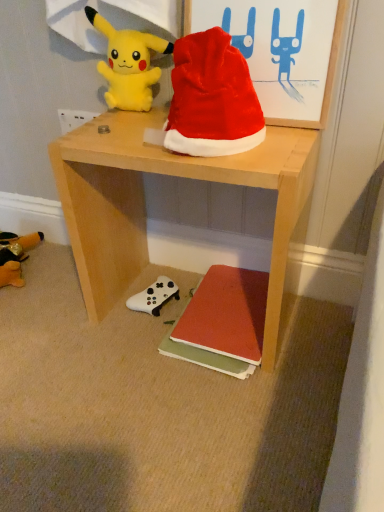
What do you see at coordinates (145, 204) in the screenshot? The image size is (384, 512). I see `light wood desk at center` at bounding box center [145, 204].

Locate an element on the screen. The image size is (384, 512). red velvet santa hat at upper center is located at coordinates (212, 98).

Describe the element at coordinates (128, 64) in the screenshot. I see `yellow plush at upper left` at that location.

Identify the location of red matte book at lower center. (222, 322).

The image size is (384, 512). In order to click on white plastic power outlet at upper left in this screenshot , I will do `click(74, 119)`.

Is red velvet santa hat at upper center closer to camera compared to yellow plush at upper left?

Yes, red velvet santa hat at upper center is in front of yellow plush at upper left.

Is red velvet santa hat at upper center placed right next to yellow plush at upper left?

No, red velvet santa hat at upper center is not touching yellow plush at upper left.

Identify the location of toy lying above the red velvet santa hat at upper center (from the image's perspective). (128, 64).

From a real-world perspective, is red velvet santa hat at upper center above or below yellow plush at upper left?

red velvet santa hat at upper center is situated lower than yellow plush at upper left in the real world.

How much distance is there between white plastic power outlet at upper left and red velvet santa hat at upper center?

white plastic power outlet at upper left and red velvet santa hat at upper center are 19.65 inches apart from each other.

Does white plastic power outlet at upper left have a greater height compared to red velvet santa hat at upper center?

No.

Consider the image. Is white plastic power outlet at upper left facing towards red velvet santa hat at upper center?

No, white plastic power outlet at upper left is not aimed at red velvet santa hat at upper center.

Which of these two, white plastic power outlet at upper left or red velvet santa hat at upper center, is bigger?

Bigger between the two is red velvet santa hat at upper center.

Who is smaller, red matte book at lower center or light wood desk at center?

red matte book at lower center is smaller.

Which is behind, red matte book at lower center or light wood desk at center?

red matte book at lower center.

From the image's perspective, is red matte book at lower center located above or below light wood desk at center?

Clearly, from the image's perspective, red matte book at lower center is below light wood desk at center.

Is red matte book at lower center directly adjacent to light wood desk at center?

No.

Which point is more distant from viewer, (x=71, y=112) or (x=239, y=287)?

The point (x=71, y=112) is behind.

Locate an element on the screen. book in front of the white plastic power outlet at upper left is located at coordinates (222, 322).

From the image's perspective, would you say white plastic power outlet at upper left is shown under red matte book at lower center?

Incorrect, from the image's perspective, white plastic power outlet at upper left is higher than red matte book at lower center.

Is white plastic power outlet at upper left situated inside red matte book at lower center or outside?

white plastic power outlet at upper left is not inside red matte book at lower center, it's outside.

Does yellow plush at upper left touch red velvet santa hat at upper center?

yellow plush at upper left and red velvet santa hat at upper center are not in contact.

Which is behind, yellow plush at upper left or red velvet santa hat at upper center?

Positioned behind is yellow plush at upper left.

Locate an element on the screen. hat in front of the yellow plush at upper left is located at coordinates (212, 98).

Does point (124, 101) lie behind point (186, 62)?

Yes, it is behind point (186, 62).

Between red matte book at lower center and white plastic power outlet at upper left, which one is positioned in front?

red matte book at lower center is closer to the camera.

Between red matte book at lower center and white plastic power outlet at upper left, which one has more height?

white plastic power outlet at upper left is taller.

Can you tell me how much red matte book at lower center and white plastic power outlet at upper left differ in facing direction?

The facing directions of red matte book at lower center and white plastic power outlet at upper left are 3.14 degrees apart.

Considering the points (211, 323) and (64, 124), which point is behind, point (211, 323) or point (64, 124)?

The point (64, 124) is more distant.

Which is less distant, (139, 110) or (224, 318)?

Point (139, 110).

How much distance is there between yellow plush at upper left and red matte book at lower center?

yellow plush at upper left and red matte book at lower center are 56.49 centimeters apart.

Which object is more forward, yellow plush at upper left or red matte book at lower center?

yellow plush at upper left is more forward.

In the scene shown: Is yellow plush at upper left facing away from red matte book at lower center?

yellow plush at upper left is not turned away from red matte book at lower center.

Identify the location of hat lying in front of the yellow plush at upper left. (212, 98).

Find the location of `power outlet above the red velvet santa hat at upper center (from the image's perspective)`. power outlet above the red velvet santa hat at upper center (from the image's perspective) is located at coordinates (74, 119).

Estimate the real-world distances between objects in this image. Which object is closer to red velvet santa hat at upper center, light wood desk at center or red matte book at lower center?

Based on the image, light wood desk at center appears to be nearer to red velvet santa hat at upper center.

From the image, which object appears to be farther from red matte book at lower center, light wood desk at center or yellow plush at upper left?

yellow plush at upper left lies further to red matte book at lower center than the other object.

When comparing their distances from red matte book at lower center, does yellow plush at upper left or white plastic power outlet at upper left seem further?

Based on the image, white plastic power outlet at upper left appears to be further to red matte book at lower center.

Based on the photo, looking at the image, which one is located closer to red matte book at lower center, white plastic power outlet at upper left or yellow plush at upper left?

yellow plush at upper left lies closer to red matte book at lower center than the other object.

Based on the photo, when comparing their distances from red matte book at lower center, does red velvet santa hat at upper center or light wood desk at center seem further?

red velvet santa hat at upper center lies further to red matte book at lower center than the other object.

Considering their positions, is white plastic power outlet at upper left positioned closer to red matte book at lower center than red velvet santa hat at upper center?

The object closer to red matte book at lower center is red velvet santa hat at upper center.

Which object lies further to the anchor point white plastic power outlet at upper left, light wood desk at center or red matte book at lower center?

red matte book at lower center is positioned further to the anchor white plastic power outlet at upper left.

When comparing their distances from red matte book at lower center, does light wood desk at center or white plastic power outlet at upper left seem further?

white plastic power outlet at upper left.

Locate an element on the screen. The image size is (384, 512). toy between red velvet santa hat at upper center and white plastic power outlet at upper left from front to back is located at coordinates (128, 64).

The width and height of the screenshot is (384, 512). I want to click on desk between red velvet santa hat at upper center and red matte book at lower center in the up-down direction, so click(x=145, y=204).

At what (x,y) coordinates should I click in order to perform the action: click on hat between yellow plush at upper left and light wood desk at center in the vertical direction. Please return your answer as a coordinate pair (x, y). This screenshot has height=512, width=384. Looking at the image, I should click on (212, 98).

What are the coordinates of `toy between light wood desk at center and white plastic power outlet at upper left from front to back` in the screenshot? It's located at (128, 64).